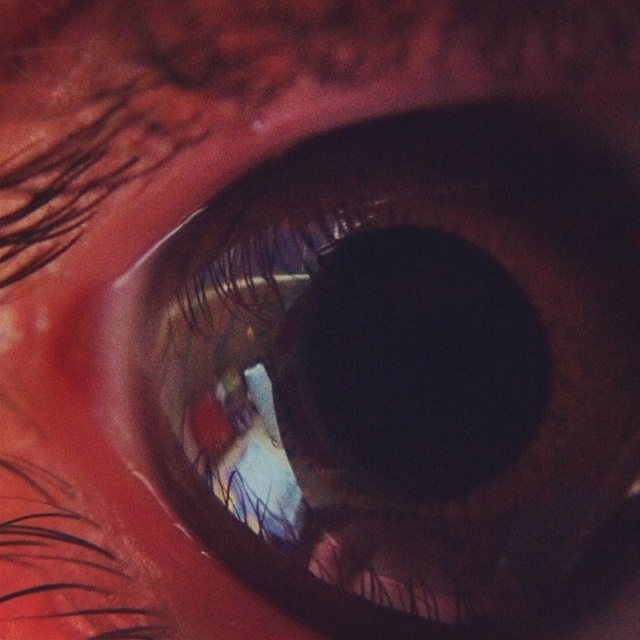
Question: Considering the relative positions of brown matte eye at center and black matte lens at center in the image provided, where is brown matte eye at center located with respect to black matte lens at center?

Choices:
 (A) above
 (B) below

Answer: (B)

Question: Which point appears closest to the camera in this image?

Choices:
 (A) (451, 202)
 (B) (429, 451)

Answer: (A)

Question: Is the position of brown matte eye at center more distant than that of black matte lens at center?

Choices:
 (A) no
 (B) yes

Answer: (A)

Question: Can you confirm if brown matte eye at center is wider than black matte lens at center?

Choices:
 (A) yes
 (B) no

Answer: (A)